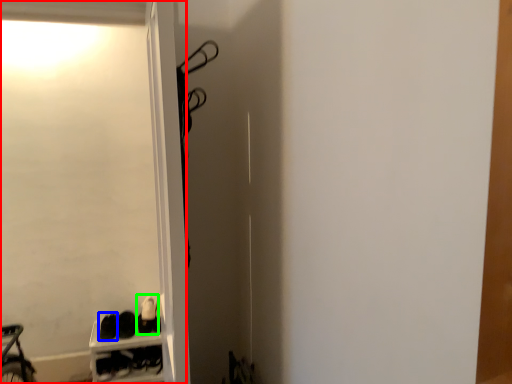
Question: Which is farther away from screen door (highlighted by a red box)? footwear (highlighted by a blue box) or footwear (highlighted by a green box)?

Choices:
 (A) footwear
 (B) footwear

Answer: (A)